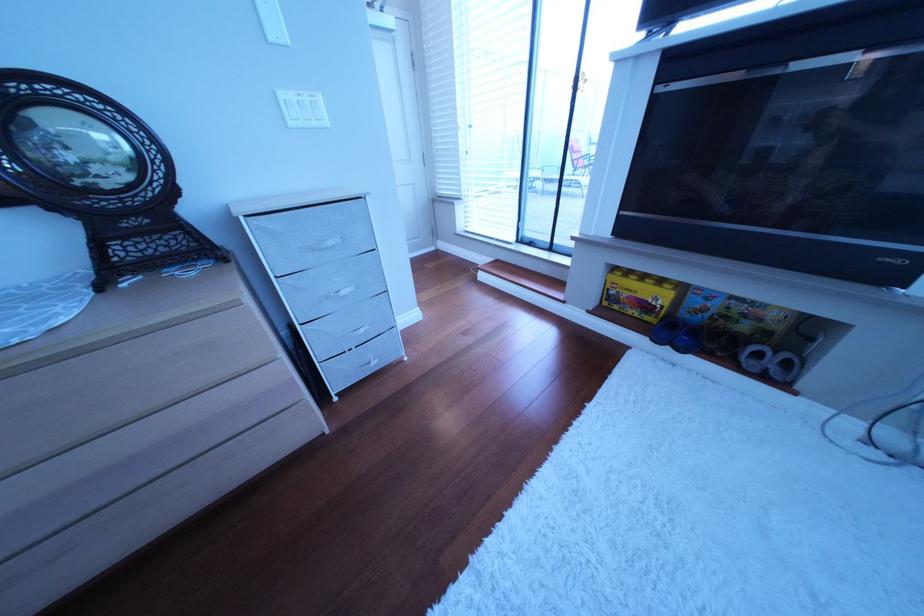
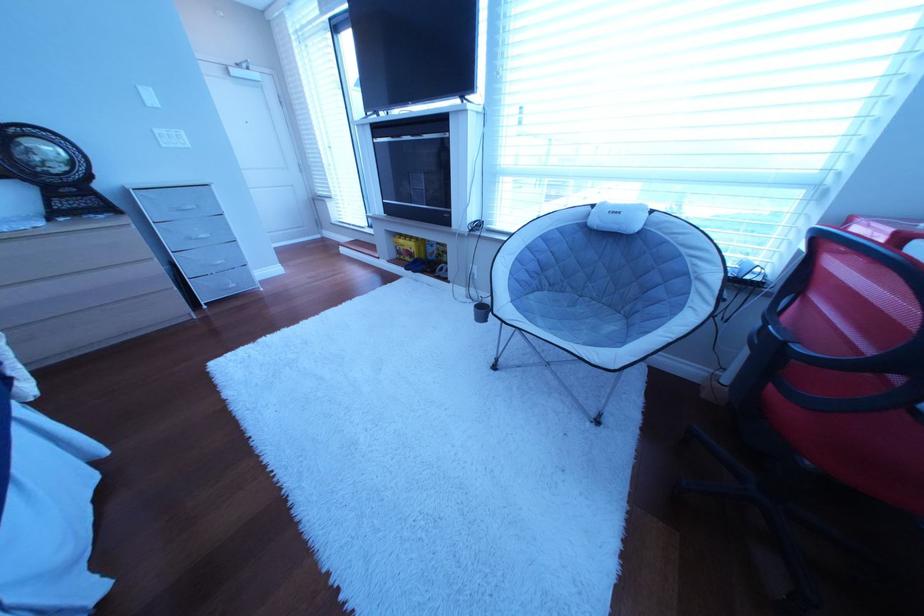
In a continuous first-person perspective shot, in which direction is the camera moving?

The cameraman moved toward right, backward.